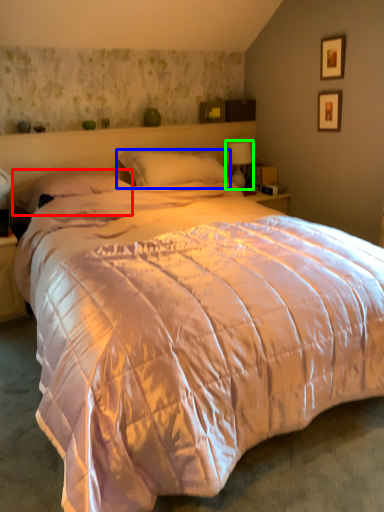
Question: Estimate the real-world distances between objects in this image. Which object is farther from pillow (highlighted by a red box), pillow (highlighted by a blue box) or table lamp (highlighted by a green box)?

Choices:
 (A) pillow
 (B) table lamp

Answer: (B)